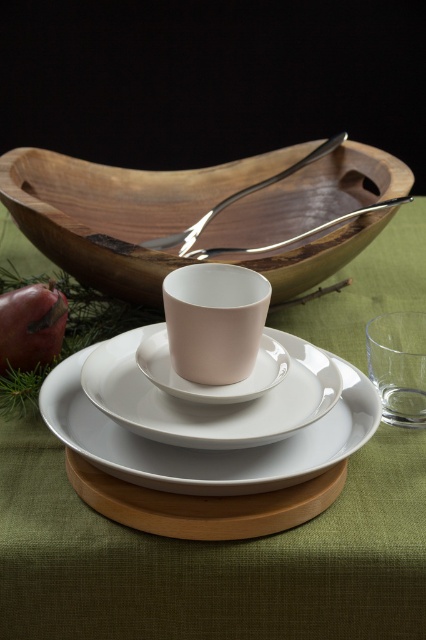
Is wooden bowl at upper center bigger than polished metal spoon at upper center?

Yes.

Is wooden bowl at upper center taller than polished metal spoon at upper center?

Yes.

Locate an element on the screen. This screenshot has height=640, width=426. wooden bowl at upper center is located at coordinates (120, 211).

Which is above, wooden bowl at upper center or matte ceramic cup at center?

Positioned higher is wooden bowl at upper center.

Can you confirm if wooden bowl at upper center is smaller than matte ceramic cup at center?

No.

Identify the location of wooden bowl at upper center. (120, 211).

This screenshot has width=426, height=640. I want to click on wooden bowl at upper center, so click(x=120, y=211).

Is matte ceramic cup at center positioned in front of polished metal spoon at upper center?

Yes, it is.

Looking at this image, how distant is matte ceramic cup at center from polished metal spoon at upper center?

They are 6.93 inches apart.

Is point (261, 307) positioned in front of point (169, 237)?

Yes, point (261, 307) is closer to viewer.

Find the location of a particular element. The height and width of the screenshot is (640, 426). matte ceramic cup at center is located at coordinates (215, 321).